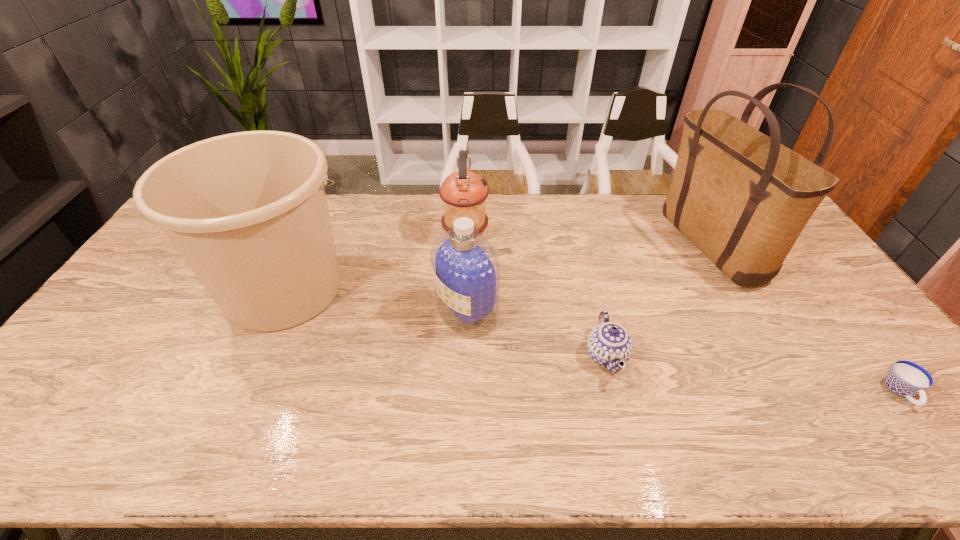
At what (x,y) coordinates should I click in order to perform the action: click on vacant space located 0.290m on the left of the second object from right to left. Please return your answer as a coordinate pair (x, y). Image resolution: width=960 pixels, height=540 pixels. Looking at the image, I should click on (583, 245).

Where is `blank area located 0.360m on the right of the leftmost object`? blank area located 0.360m on the right of the leftmost object is located at coordinates tap(476, 289).

Locate an element on the screen. free space located 0.220m on the front of the cleansing agent is located at coordinates (464, 414).

The width and height of the screenshot is (960, 540). Find the location of `blank space located 0.200m on the left of the oil lamp`. blank space located 0.200m on the left of the oil lamp is located at coordinates (384, 236).

Locate an element on the screen. Image resolution: width=960 pixels, height=540 pixels. free point located at the spout of the chinaware is located at coordinates (455, 356).

At what (x,y) coordinates should I click in order to perform the action: click on vacant point located at the spout of the chinaware. Please return your answer as a coordinate pair (x, y). This screenshot has height=540, width=960. Looking at the image, I should click on (436, 356).

Where is `vacant space located at the spout of the chinaware`? vacant space located at the spout of the chinaware is located at coordinates (512, 356).

Identify the location of vacant region located on the side of the rightmost object with the handle. (931, 432).

Locate an element on the screen. tote bag present at the far edge is located at coordinates (742, 198).

You are a GUI agent. You are given a task and a screenshot of the screen. Output one action in this format:
    pyautogui.click(x=<x>, y=<y>)
    Task: Click on the oil lamp that is positioned at the far edge
    The width and height of the screenshot is (960, 540).
    Given the screenshot: What is the action you would take?
    pyautogui.click(x=464, y=193)